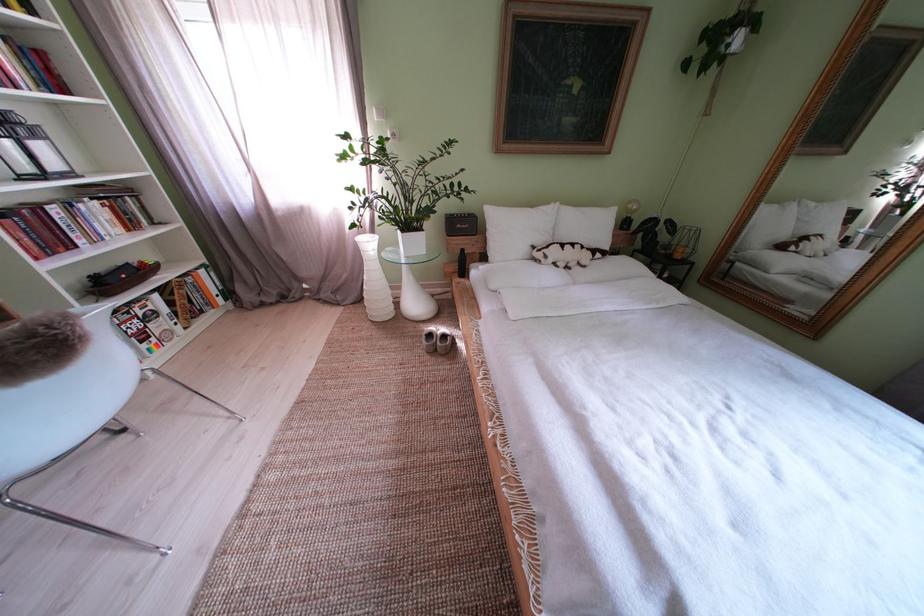
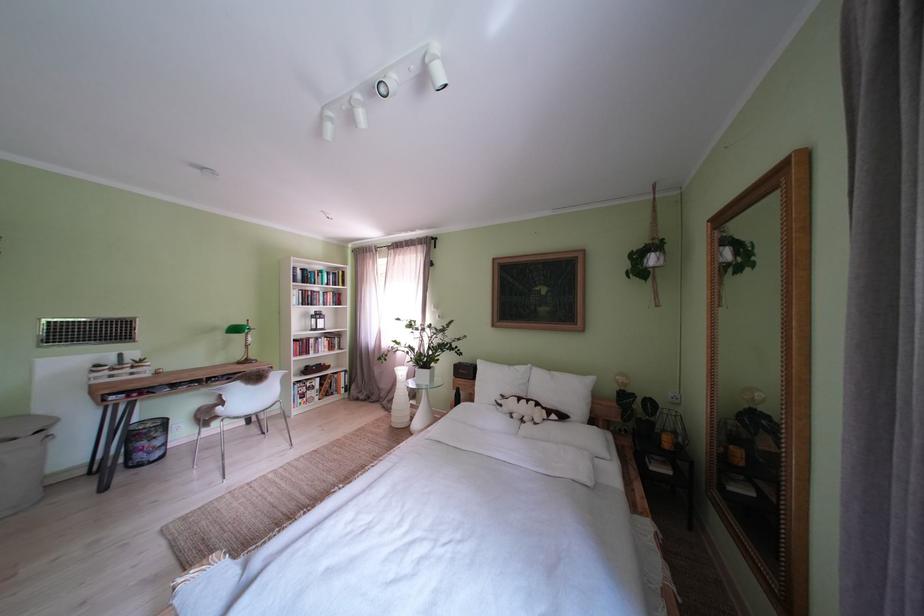
The point at [350,302] is marked in the first image. Where is the corresponding point in the second image?

(400, 411)